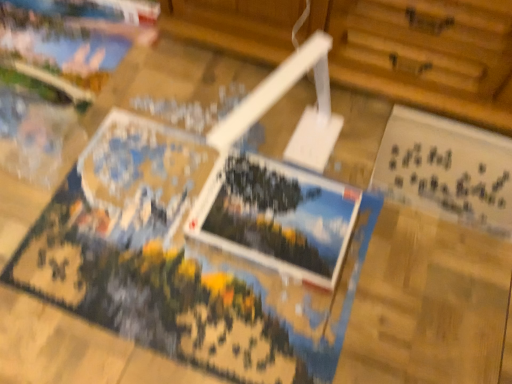
I want to click on vacant region to the left of printed paper postcard at center, which ranks as the 2th postcard in right-to-left order, so click(x=154, y=223).